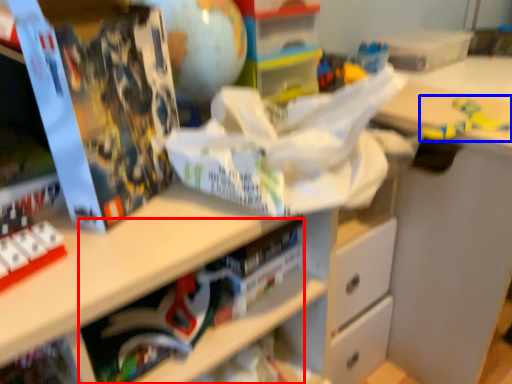
Question: Which object appears farthest to the camera in this image, book (highlighted by a red box) or toy (highlighted by a blue box)?

Choices:
 (A) book
 (B) toy

Answer: (B)